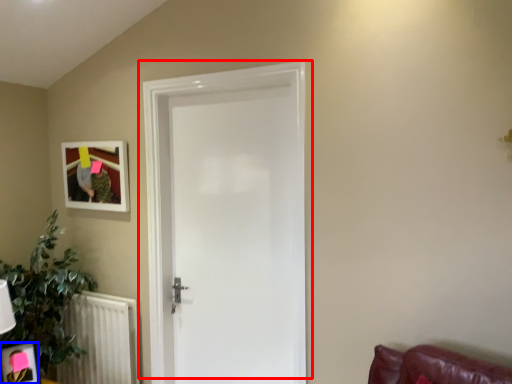
Question: Which of the following is the closest to the observer, door (highlighted by a red box) or picture frame (highlighted by a blue box)?

Choices:
 (A) door
 (B) picture frame

Answer: (A)